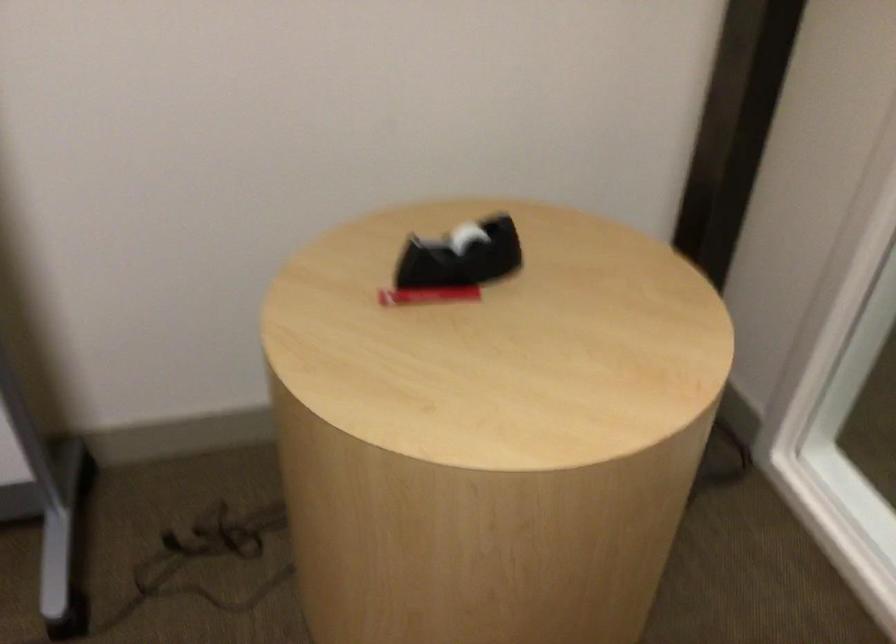
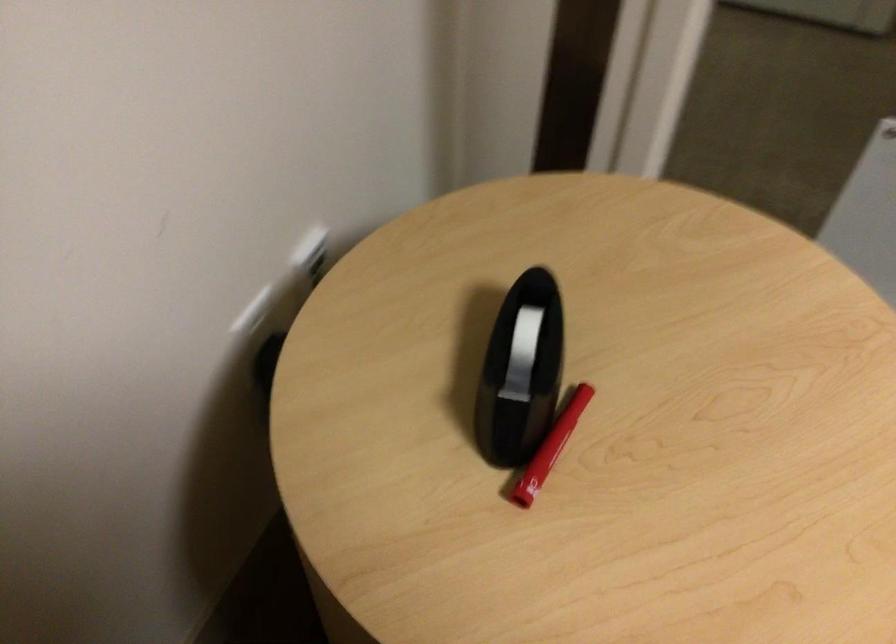
The point at (429, 242) is marked in the first image. Where is the corresponding point in the second image?

(521, 371)